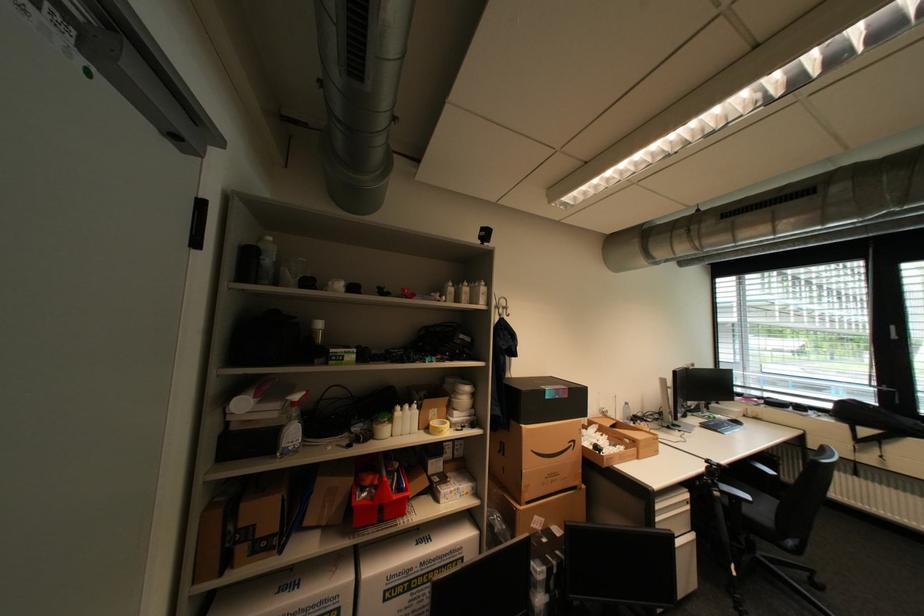
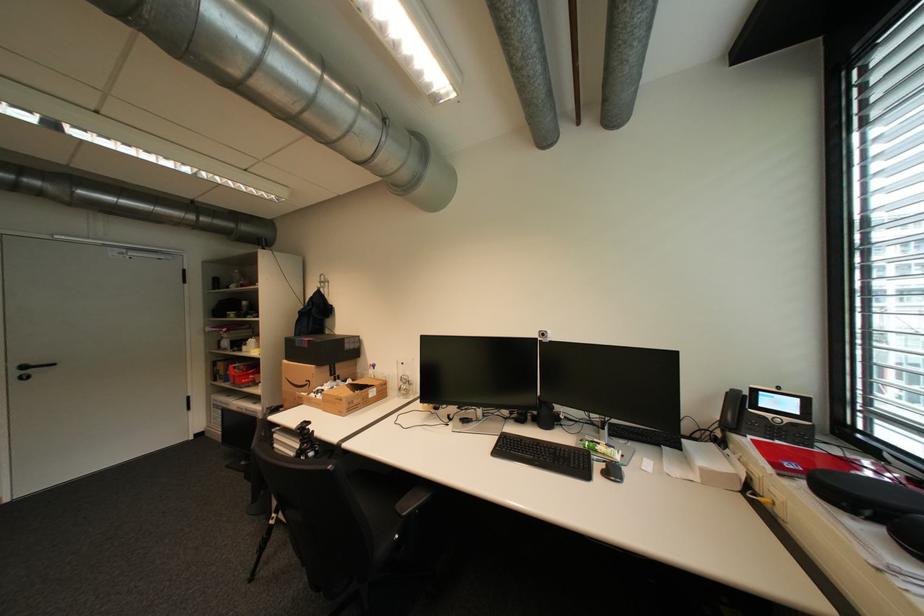
Locate, in the second image, the point that corresponds to the point at 580,444 in the first image.

(317, 383)